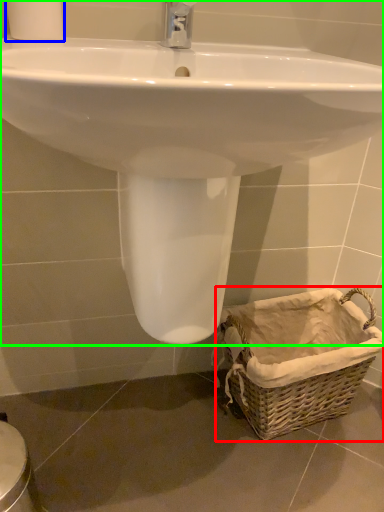
Question: Considering the real-world distances, which object is farthest from basket (highlighted by a red box)? toilet paper (highlighted by a blue box) or sink (highlighted by a green box)?

Choices:
 (A) toilet paper
 (B) sink

Answer: (A)